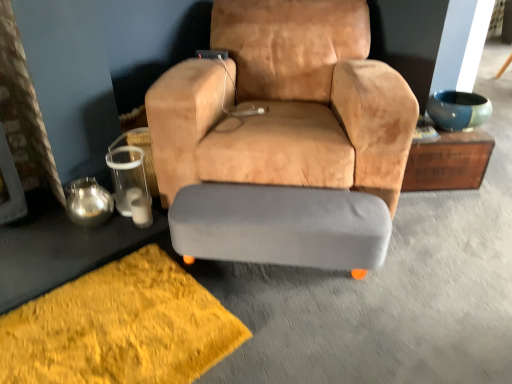
This screenshot has height=384, width=512. I want to click on free space to the right of shaggy yellow rug at lower left, so click(x=298, y=332).